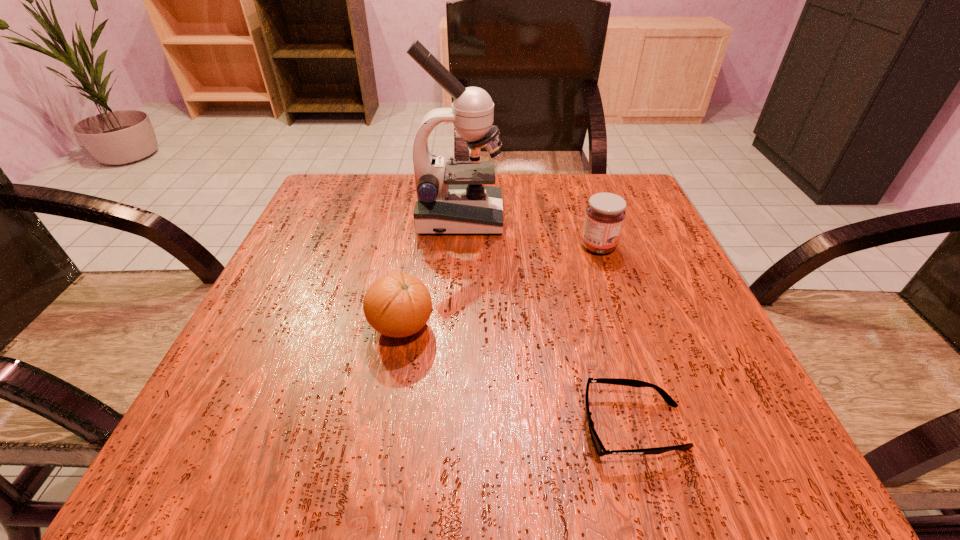
Identify the location of free region located 0.240m on the front-facing side of the nearest object. The width and height of the screenshot is (960, 540). (405, 427).

Identify the location of object that is at the far edge. This screenshot has width=960, height=540. (454, 198).

At what (x,y) coordinates should I click in order to perform the action: click on object present at the near edge. Please return your answer as a coordinate pair (x, y). Looking at the image, I should click on (600, 449).

Identify the location of jam that is at the right edge. (605, 213).

The image size is (960, 540). I want to click on sunglasses that is at the right edge, so click(x=600, y=449).

The image size is (960, 540). Find the location of `object located at the near right corner`. object located at the near right corner is located at coordinates (600, 449).

Image resolution: width=960 pixels, height=540 pixels. In the image, there is a desktop. What are the coordinates of `vacant space at the far edge` in the screenshot? It's located at (571, 211).

The height and width of the screenshot is (540, 960). I want to click on vacant space at the near edge of the desktop, so click(595, 475).

What are the coordinates of `vacant space at the left edge of the desktop` in the screenshot? It's located at point(352,263).

In the image, there is a desktop. Where is `free space at the right edge`? The image size is (960, 540). free space at the right edge is located at coordinates (640, 315).